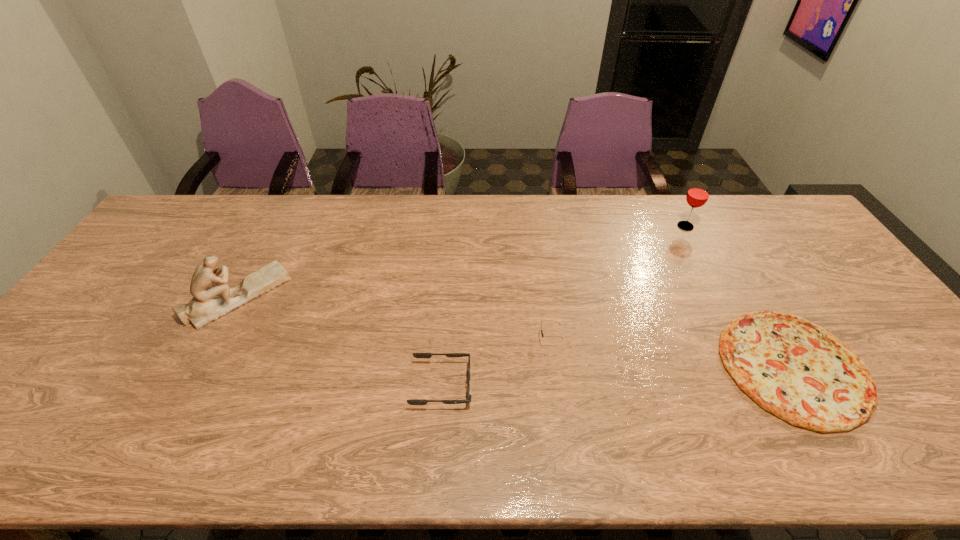
What are the coordinates of `vacant space in between the glass and the leftmost object` in the screenshot? It's located at (462, 261).

This screenshot has width=960, height=540. I want to click on free space between the pizza and the second object from left to right, so click(x=617, y=376).

Where is `vacant space in between the leftmost object and the pizza`? Image resolution: width=960 pixels, height=540 pixels. vacant space in between the leftmost object and the pizza is located at coordinates (516, 332).

The image size is (960, 540). Identify the location of vacant area that lies between the leftmost object and the nearer sunglasses. (340, 341).

Where is `object identified as the second closest to the farthest object`? This screenshot has width=960, height=540. object identified as the second closest to the farthest object is located at coordinates (542, 334).

Locate an element on the screen. The image size is (960, 540). object that is the second closest to the figurine is located at coordinates click(542, 334).

Find the location of `free location that satisfies the following two spatial constraints: 1. on the front-facing side of the pizza; 2. on the left side of the leftmost object`. free location that satisfies the following two spatial constraints: 1. on the front-facing side of the pizza; 2. on the left side of the leftmost object is located at coordinates point(201,367).

I want to click on free space that satisfies the following two spatial constraints: 1. on the front side of the glass; 2. in front of the lenses of the third shortest object, so click(x=745, y=340).

Locate an element on the screen. vacant space that satisfies the following two spatial constraints: 1. in front of the lenses of the pizza; 2. on the right side of the third shortest object is located at coordinates (553, 367).

You are a GUI agent. You are given a task and a screenshot of the screen. Output one action in this format:
    pyautogui.click(x=<x>, y=<y>)
    Task: Click on the free space that satisfies the following two spatial constraints: 1. on the back side of the shortest object; 2. in front of the lenses of the farther sunglasses
    Image resolution: width=960 pixels, height=540 pixels.
    Given the screenshot: What is the action you would take?
    pyautogui.click(x=777, y=340)